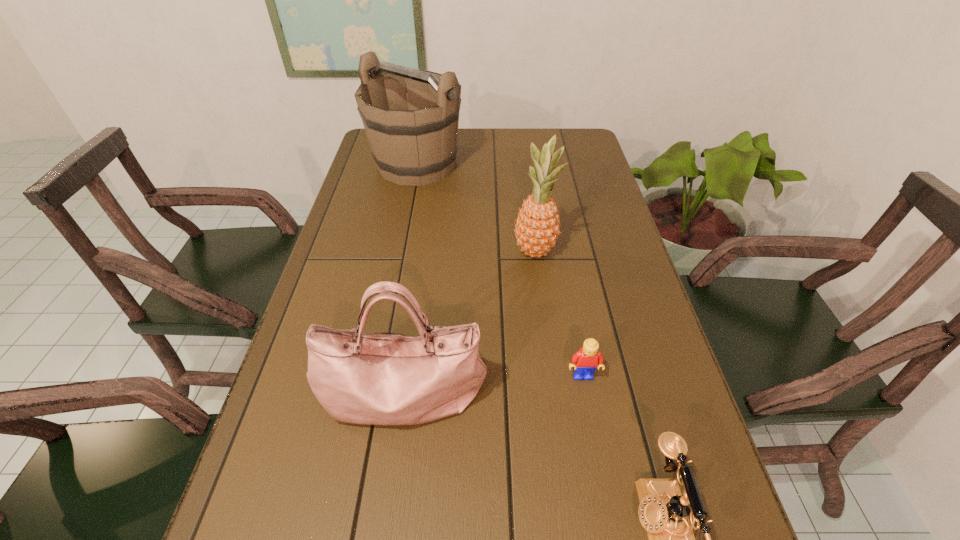
Image resolution: width=960 pixels, height=540 pixels. I want to click on the farthest object, so click(x=413, y=141).

At what (x,y) coordinates should I click in order to perform the action: click on the fourth nearest object. Please return your answer as a coordinate pair (x, y). Looking at the image, I should click on (537, 226).

Locate an element on the screen. handbag is located at coordinates (383, 378).

You are a GUI agent. You are given a task and a screenshot of the screen. Output one action in this format:
    pyautogui.click(x=<x>, y=<y>)
    Task: Click on the shortest object
    This screenshot has height=540, width=960.
    Given the screenshot: What is the action you would take?
    pyautogui.click(x=585, y=361)

The height and width of the screenshot is (540, 960). I want to click on free space located on the front of the farthest object, so click(x=404, y=233).

At what (x,y) coordinates should I click in order to perform the action: click on free spot located 0.180m on the left of the fourth nearest object. Please return your answer as a coordinate pair (x, y). Looking at the image, I should click on (445, 251).

This screenshot has height=540, width=960. Identify the location of vacant space located on the front-facing side of the shortest object. [609, 511].

What are the coordinates of `object at the far edge` in the screenshot? It's located at (413, 141).

At what (x,y) coordinates should I click in order to perform the action: click on bucket at the left edge. Please return your answer as a coordinate pair (x, y). Image resolution: width=960 pixels, height=540 pixels. Looking at the image, I should click on (413, 141).

Where is `handbag located at the left edge`? The image size is (960, 540). handbag located at the left edge is located at coordinates (383, 378).